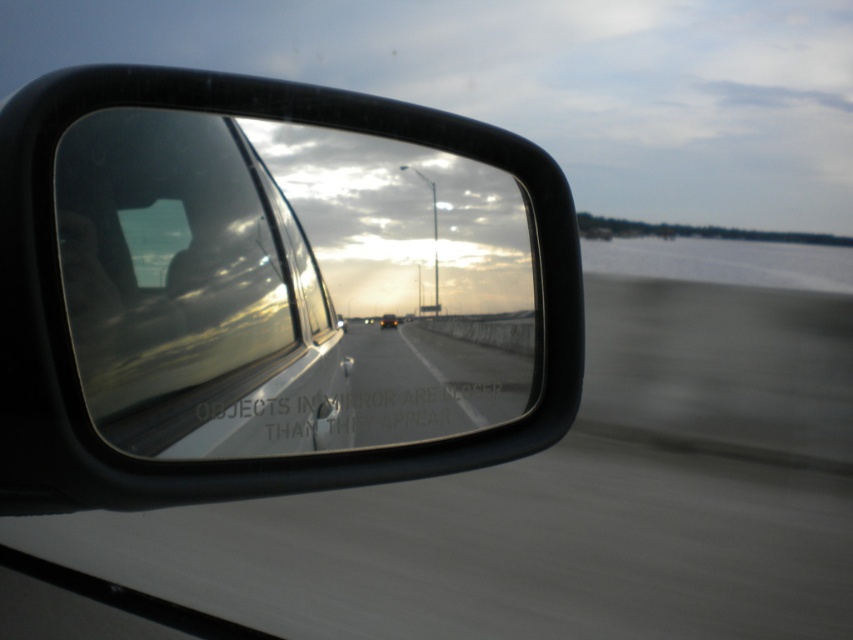
Consider the image. Is black plastic rearview mirror at upper left thinner than transparent glass car window at center?

Incorrect, black plastic rearview mirror at upper left's width is not less than transparent glass car window at center's.

Which is more to the left, black plastic rearview mirror at upper left or transparent glass car window at center?

Positioned to the left is transparent glass car window at center.

Does point (264, 120) come in front of point (93, 388)?

No, (264, 120) is behind (93, 388).

The width and height of the screenshot is (853, 640). I want to click on black plastic rearview mirror at upper left, so click(x=270, y=291).

Consider the image. Does transparent glass car window at center have a greater height compared to matte black car at center?

Indeed, transparent glass car window at center has a greater height compared to matte black car at center.

Is point (213, 440) positioned after point (393, 316)?

That is False.

The width and height of the screenshot is (853, 640). What do you see at coordinates (190, 291) in the screenshot?
I see `transparent glass car window at center` at bounding box center [190, 291].

Identify the location of transparent glass car window at center. This screenshot has height=640, width=853. (190, 291).

What do you see at coordinates (270, 291) in the screenshot? I see `black plastic rearview mirror at upper left` at bounding box center [270, 291].

Between black plastic rearview mirror at upper left and matte black car at center, which one has less height?

With less height is matte black car at center.

Is point (538, 282) positioned behind point (379, 324)?

Yes, point (538, 282) is farther from viewer.

Find the location of a particular element. The image size is (853, 640). black plastic rearview mirror at upper left is located at coordinates (270, 291).